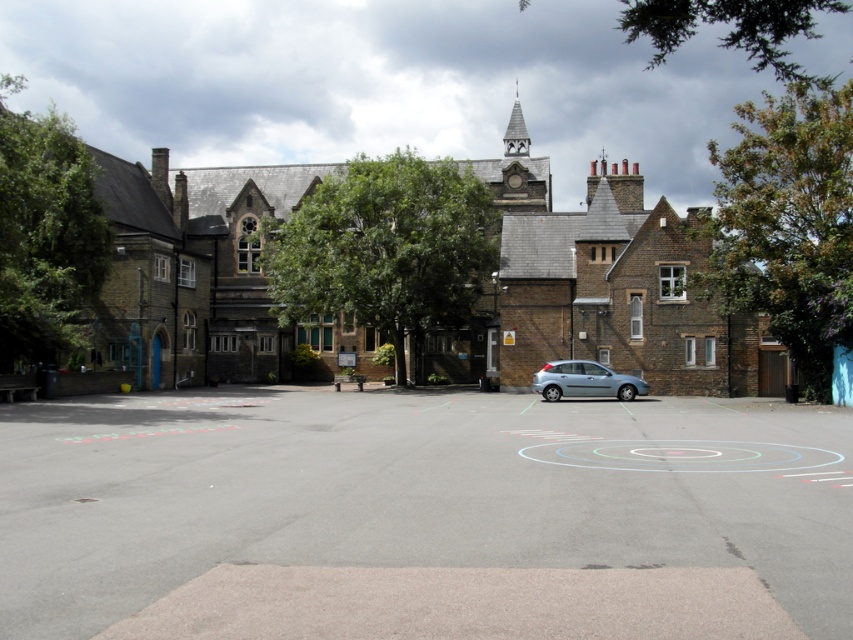
Question: Is green leafy tree at upper right to the right of green leafy tree at upper center from the viewer's perspective?

Choices:
 (A) yes
 (B) no

Answer: (A)

Question: Which point is farther to the camera?

Choices:
 (A) (15, 326)
 (B) (438, 492)
 (C) (337, 184)

Answer: (C)

Question: Which point is farther to the camera?

Choices:
 (A) (743, 180)
 (B) (514, 112)

Answer: (B)

Question: Can you confirm if satin silver car at center is positioned to the left of wooden spire at upper center?

Choices:
 (A) yes
 (B) no

Answer: (A)

Question: Based on their relative distances, which object is nearer to the green leafy tree at upper right?

Choices:
 (A) satin silver car at center
 (B) green leafy tree at left
 (C) green leafy tree at upper center

Answer: (A)

Question: Observing the image, what is the correct spatial positioning of green leafy tree at center in reference to satin silver car at center?

Choices:
 (A) below
 (B) above

Answer: (B)